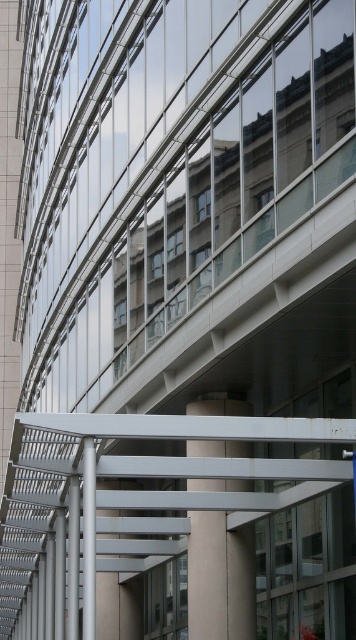
You are standing at the entrance of the building and want to reach the covered walkway. Which direction should you move relative to the white matte pillar at center?

To reach the covered walkway from the entrance, you should move towards the white matte pillar at center as it is centrally located under the walkway, guiding you in the right direction.

You are a maintenance worker needing to move a 12 meter long equipment between the white matte pillar at center and the silver metallic pole at center. Can you fit it through the space between them?

The white matte pillar at center and silver metallic pole at center are 12.58 meters apart from each other, so yes, the 12 meter long equipment can fit through the space between them as the distance is slightly larger than the equipment.